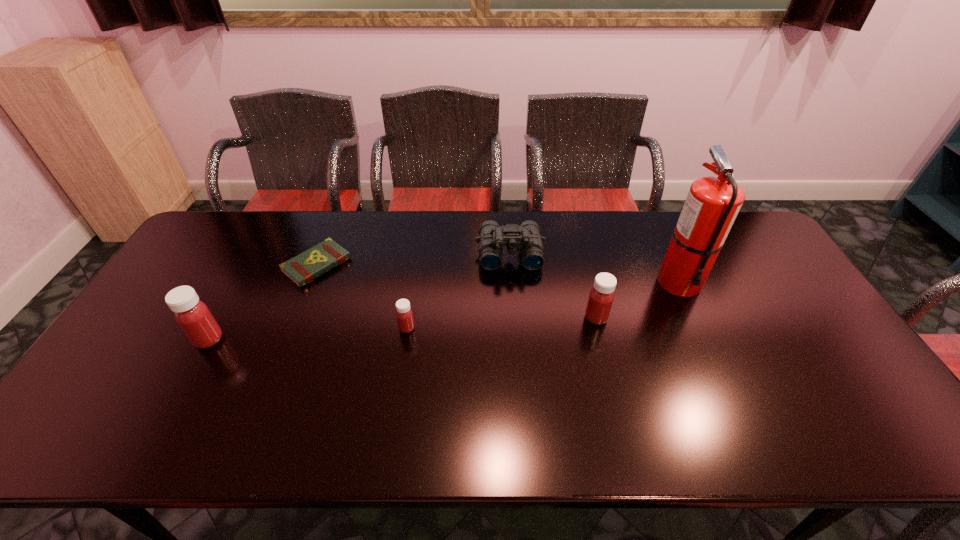
In the image, there is a desktop. Where is `vacant space at the near edge`? The image size is (960, 540). vacant space at the near edge is located at coordinates (203, 399).

I want to click on vacant space at the left edge, so click(x=192, y=284).

In the image, there is a desktop. Identify the location of vacant space at the right edge. The image size is (960, 540). (797, 291).

This screenshot has height=540, width=960. I want to click on vacant space at the far left corner, so click(196, 241).

Where is `free space at the far right corner`? The height and width of the screenshot is (540, 960). free space at the far right corner is located at coordinates (734, 239).

You are a GUI agent. You are given a task and a screenshot of the screen. Output one action in this format:
    pyautogui.click(x=<x>, y=<y>)
    Task: Click on the vacant region between the shortest object and the tallest object
    
    Given the screenshot: What is the action you would take?
    pyautogui.click(x=498, y=273)

The height and width of the screenshot is (540, 960). Identify the location of vacant space that is in between the fifth object from left to right and the fourth object from right to left. point(501,323).

Where is `vacant point located between the fourth object from right to left and the leftmost medicine`? Image resolution: width=960 pixels, height=540 pixels. vacant point located between the fourth object from right to left and the leftmost medicine is located at coordinates (308, 334).

You are a GUI agent. You are given a task and a screenshot of the screen. Output one action in this format:
    pyautogui.click(x=<x>, y=<y>)
    Task: Click on the vacant point located between the second object from left to right and the rightmost medicine
    
    Given the screenshot: What is the action you would take?
    pyautogui.click(x=457, y=291)

You are a GUI agent. You are given a task and a screenshot of the screen. Output one action in this format:
    pyautogui.click(x=<x>, y=<y>)
    Task: Click on the free spot between the rightmost medicine and the rightmost object
    This screenshot has height=540, width=960.
    Given the screenshot: What is the action you would take?
    pyautogui.click(x=637, y=300)